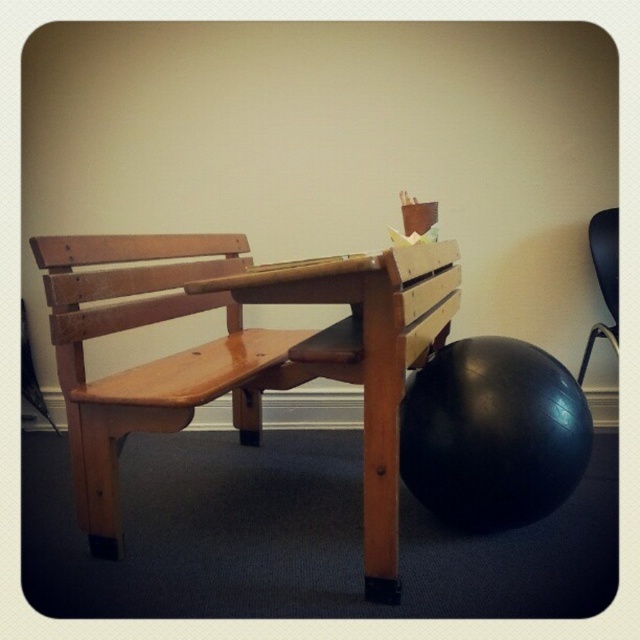
You are standing in the room and want to determine which of the two points, point (364, 342) or point (516, 508), is nearer to you. Based on the scene description, which point is closer?

Point (364, 342) is closer to the viewer than point (516, 508).

You are a person who is 1.8 meters tall and wants to move from the wooden bench at center to the black rubber ball at lower right. The space between them is 22.54 centimeters. Can you comfortably walk through this space without bending or moving the objects?

The distance between the wooden bench at center and the black rubber ball at lower right is only 22.54 centimeters, which is too narrow for a person of 1.8 meters to walk through comfortably without bending or moving the objects.